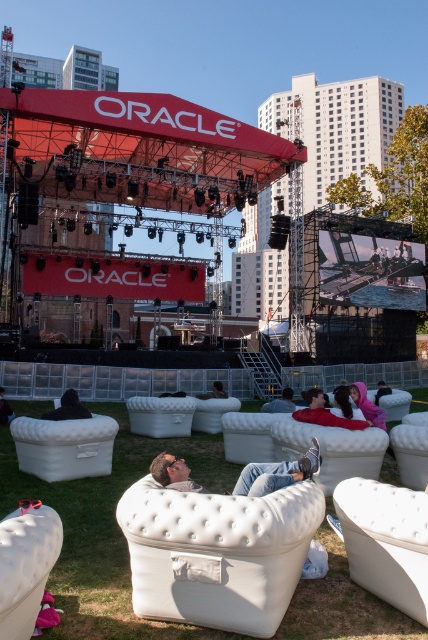
You are standing at the point marked as point (276, 474). You want to move towards the stage. Which direction should you go?

The point (276, 474) corresponds to the light brown leather couch at center. To move towards the stage, you should go forward since the couch is centered and the stage is in front of the audience area.

In the scene shown: You are standing in the audience area and want to take a photo of the stage. You notice two points marked in the image. Which point, point (244,472) or point (59,419), is closer to you when you look towards the stage?

Point (244,472) is closer to you than point (59,419) because it is nearer to the camera position.

You are an event planner checking the layout of the outdoor event setup. You need to place a new 3x3 meter promotional banner. Which area would you choose between the green soft grass at lower center and the light brown leather couch at center, and why?

The green soft grass at lower center is larger in size than the light brown leather couch at center, so the banner can be placed there without overcrowding the space.